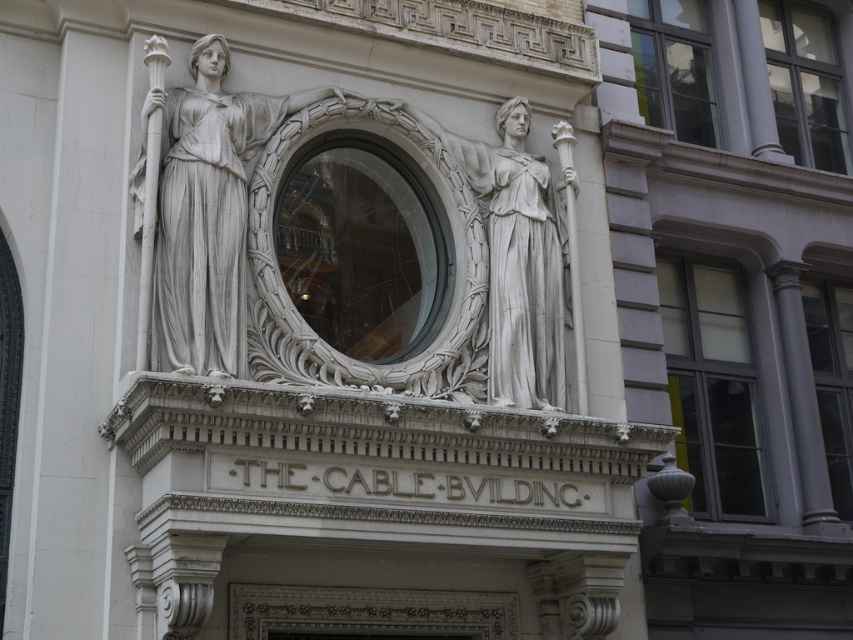
Question: Which point appears farthest from the camera in this image?

Choices:
 (A) (184, 113)
 (B) (541, 275)

Answer: (B)

Question: Can you confirm if white marble statue at center is thinner than white stone statue at center?

Choices:
 (A) no
 (B) yes

Answer: (B)

Question: Which object is farther from the camera taking this photo?

Choices:
 (A) white stone statue at center
 (B) white marble statue at center

Answer: (A)

Question: Is white marble statue at center to the left of white stone statue at center from the viewer's perspective?

Choices:
 (A) yes
 (B) no

Answer: (A)

Question: Can you confirm if white marble statue at center is positioned below white stone statue at center?

Choices:
 (A) yes
 (B) no

Answer: (B)